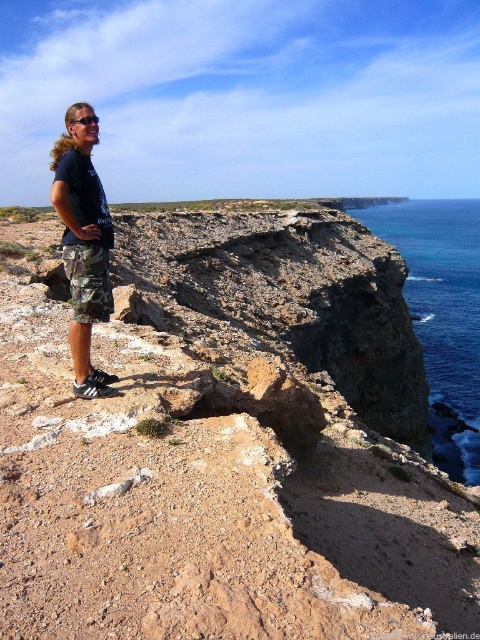
Question: In this image, where is blue liquid water at upper right located relative to camo shorts at center?

Choices:
 (A) above
 (B) below

Answer: (A)

Question: Is blue liquid water at upper right smaller than camo shorts at center?

Choices:
 (A) yes
 (B) no

Answer: (B)

Question: Which object appears farthest from the camera in this image?

Choices:
 (A) camo shorts at center
 (B) blue liquid water at upper right

Answer: (B)

Question: Which object appears farthest from the camera in this image?

Choices:
 (A) camo shorts at center
 (B) blue liquid water at upper right

Answer: (B)

Question: Can you confirm if blue liquid water at upper right is thinner than camo shorts at center?

Choices:
 (A) no
 (B) yes

Answer: (A)